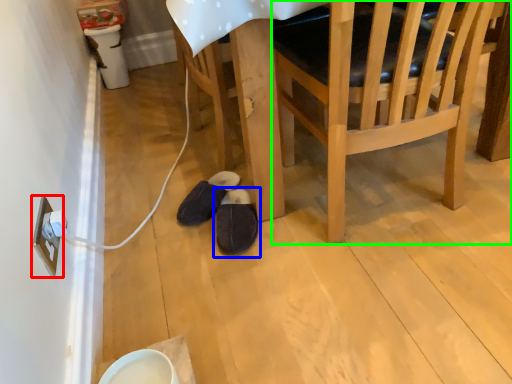
Question: Based on their relative distances, which object is farther from electric outlet (highlighted by a red box)? Choose from footwear (highlighted by a blue box) and chair (highlighted by a green box).

Choices:
 (A) footwear
 (B) chair

Answer: (B)